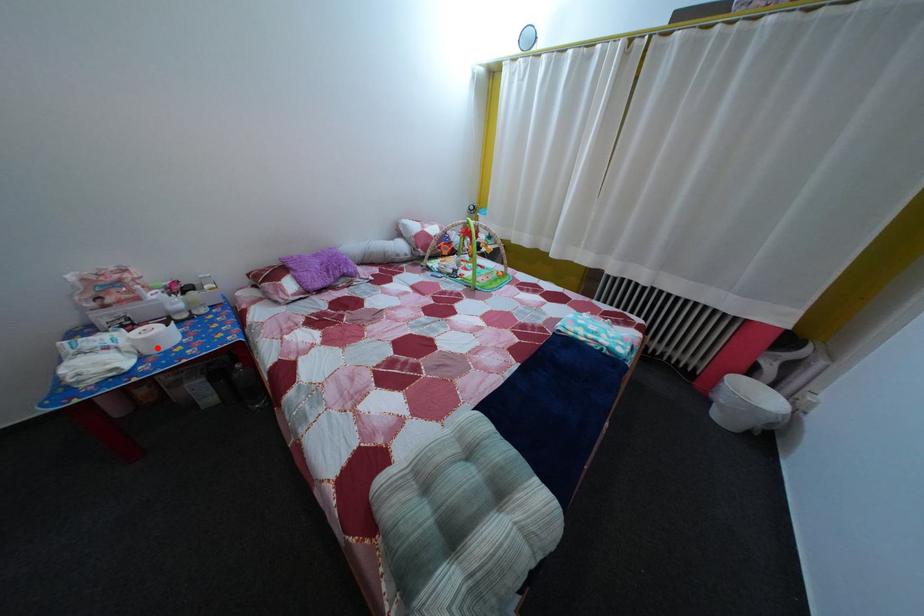
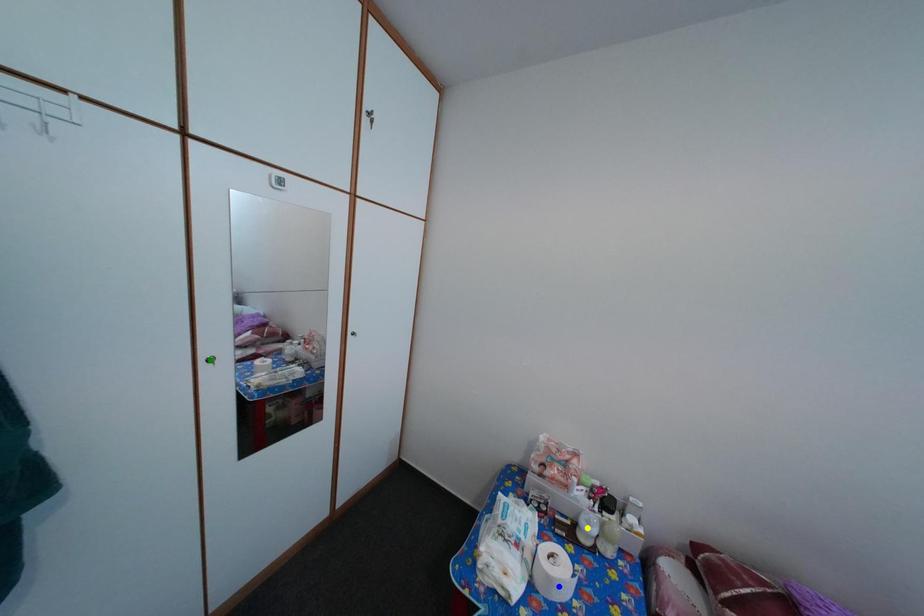
Question: I am providing you with two images of the same scene from different viewpoints. A red point is marked on the first image. You are given multiple points on the second image. In image 2, which mark is for the same physical point as the one in image 1?

Choices:
 (A) yellow point
 (B) blue point
 (C) green point

Answer: (B)